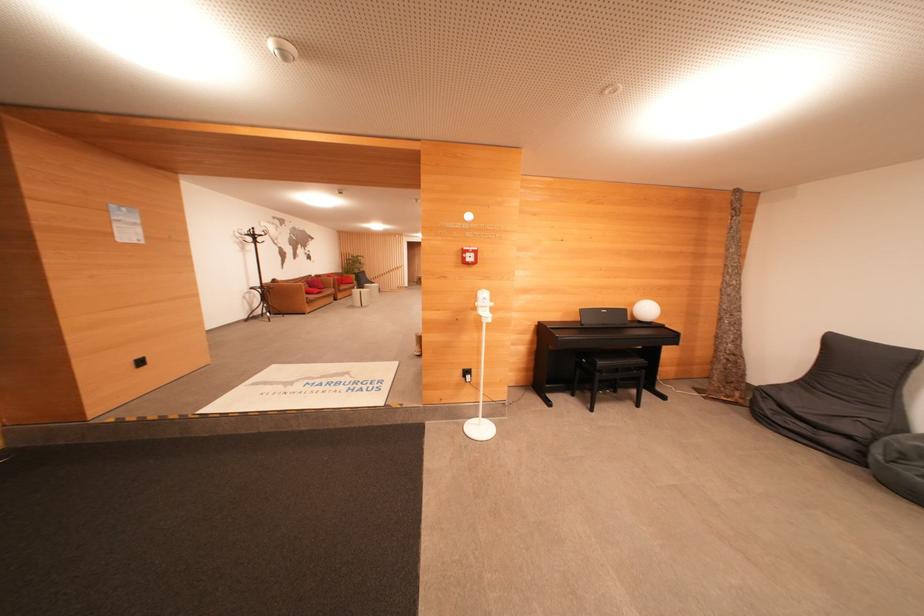
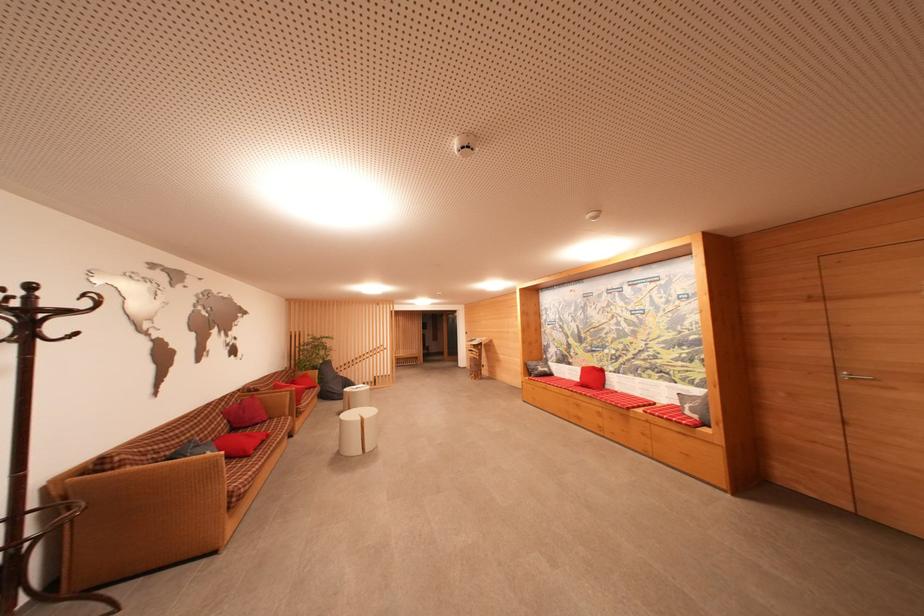
Locate, in the second image, the point that corresponds to pixel 360 274 in the first image.

(323, 365)